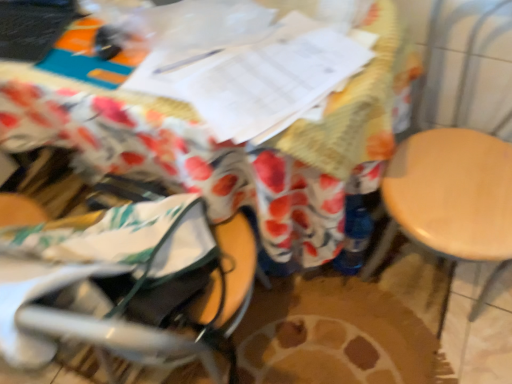
I want to click on blank space above wooden table at center (from a real-world perspective), so click(x=202, y=55).